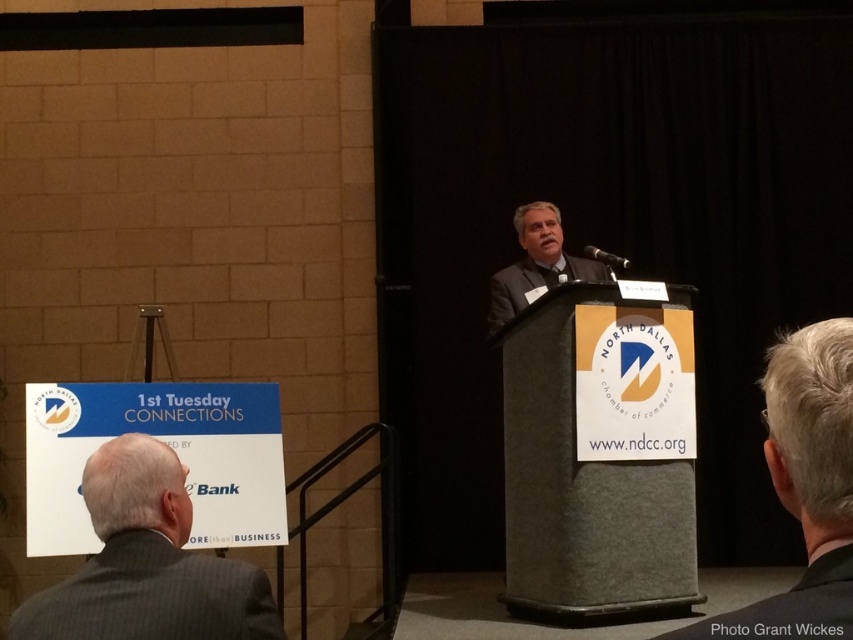
Question: Does gray suit at lower left have a smaller size compared to gray hair at center?

Choices:
 (A) no
 (B) yes

Answer: (A)

Question: Which of the following is the farthest from the observer?

Choices:
 (A) (560, 260)
 (B) (242, 612)

Answer: (A)

Question: Is gray suit at lower left below gray suit at center?

Choices:
 (A) no
 (B) yes

Answer: (B)

Question: Can you confirm if gray suit at lower left is positioned above gray hair at center?

Choices:
 (A) yes
 (B) no

Answer: (B)

Question: Which point appears closest to the camera in this image?

Choices:
 (A) (781, 358)
 (B) (231, 634)

Answer: (A)

Question: Which of the following is the farthest from the observer?

Choices:
 (A) gray suit at lower left
 (B) gray suit at center
 (C) gray hair at center

Answer: (B)